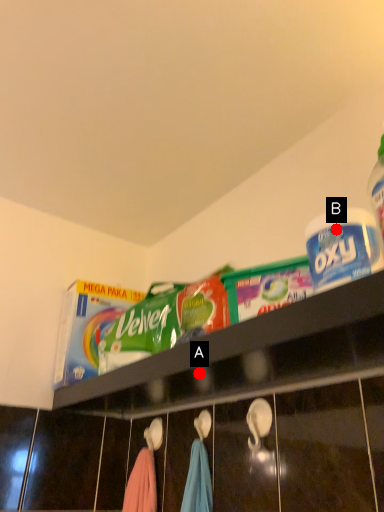
Question: Two points are circled on the image, labeled by A and B beside each circle. Which point appears farthest from the camera in this image?

Choices:
 (A) A is further
 (B) B is further

Answer: (A)